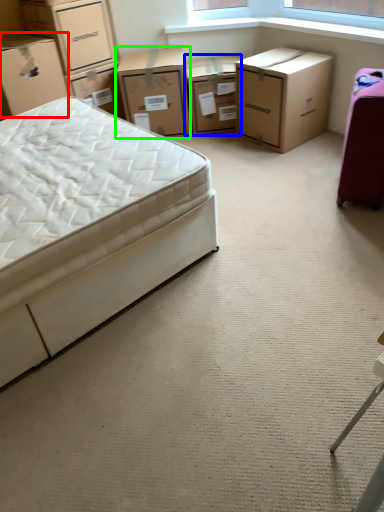
Question: Which object is the closest to the box (highlighted by a red box)? Choose among these: chest of drawers (highlighted by a blue box) or chest of drawers (highlighted by a green box).

Choices:
 (A) chest of drawers
 (B) chest of drawers

Answer: (B)